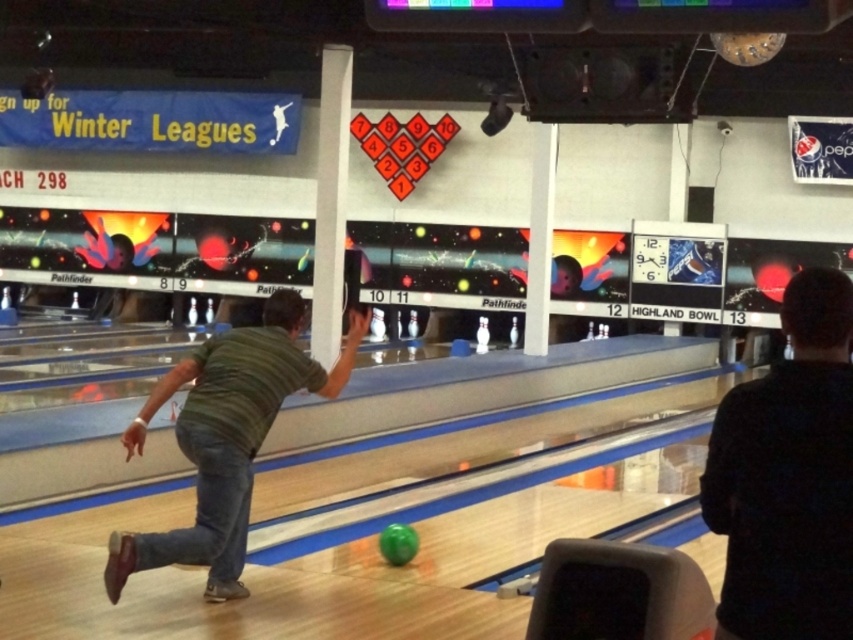
You are a bowling alley attendant and you need to direct a customer to the lane where the dark green shirt at center and green striped shirt at center are located. Which lane number should you tell them to go to?

The dark green shirt at center and green striped shirt at center are located at lane 12.